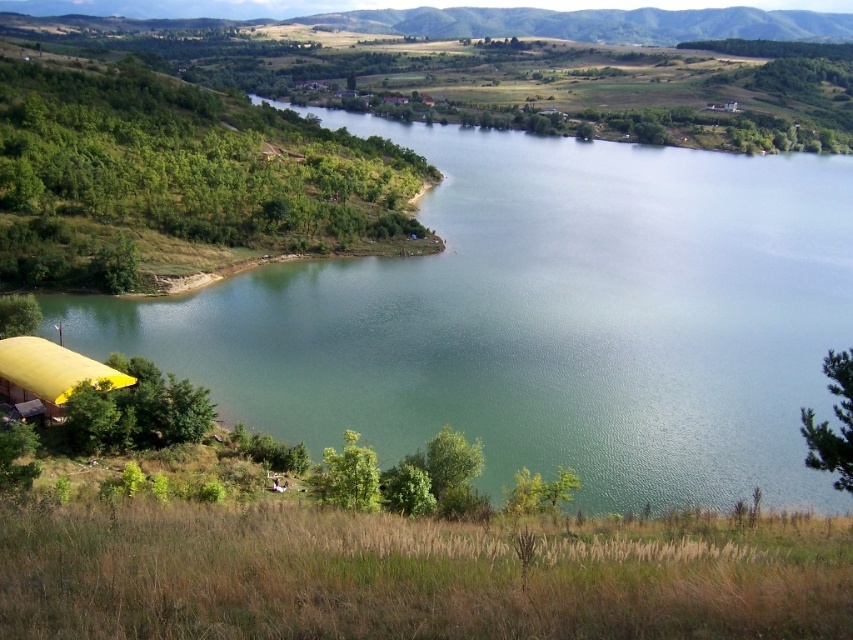
You are planning to set up a picnic area near the yellow fabric tent at lower left. Considering the space available, will the green water at center provide enough width to accommodate a small boat for a leisurely ride?

The green water at center has a larger width than the yellow fabric tent at lower left, so it should provide sufficient space for a small boat to navigate comfortably.

You are standing at the yellow structure on the left side of the image. Looking towards the lake, you notice a specific point in the water marked by coordinates. What is the color of the water at the point located at coordinates point (544, 321)?

The green water at center is represented by point (544, 321), so the color of the water at that point is green.

You are standing at the yellow fabric tent at lower left and want to reach the green water at center. Which direction should you move towards?

You should move towards the right direction to reach the green water at center from the yellow fabric tent at lower left, since the green water at center is to the right of the yellow fabric tent at lower left.